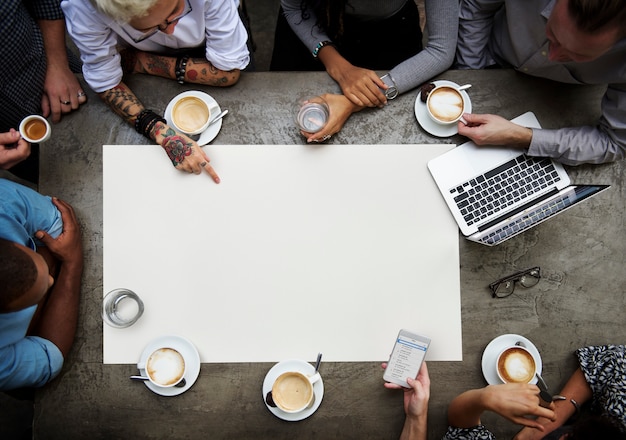
Image resolution: width=626 pixels, height=440 pixels. I want to click on glasses of water, so pos(119,291), pos(133,306), pos(115,319), pos(111,304), pos(316,117), pos(305,115), pos(317,129).